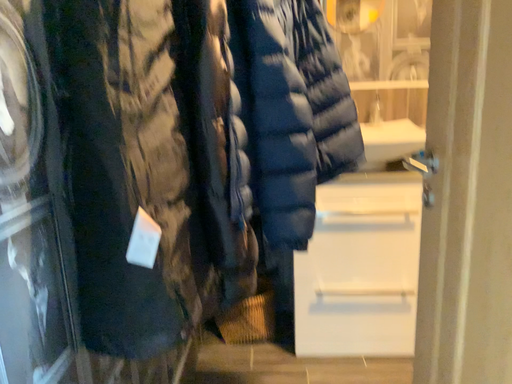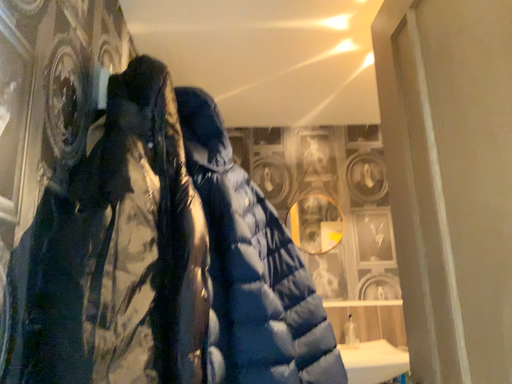
Question: Which way did the camera rotate in the video?

Choices:
 (A) rotated upward
 (B) rotated downward

Answer: (A)